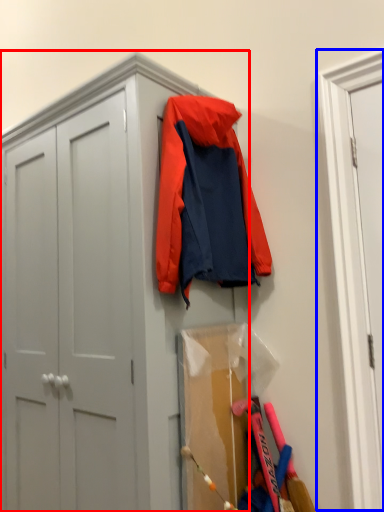
Question: Which point is further to the camera, cabinetry (highlighted by a red box) or door (highlighted by a blue box)?

Choices:
 (A) cabinetry
 (B) door

Answer: (B)